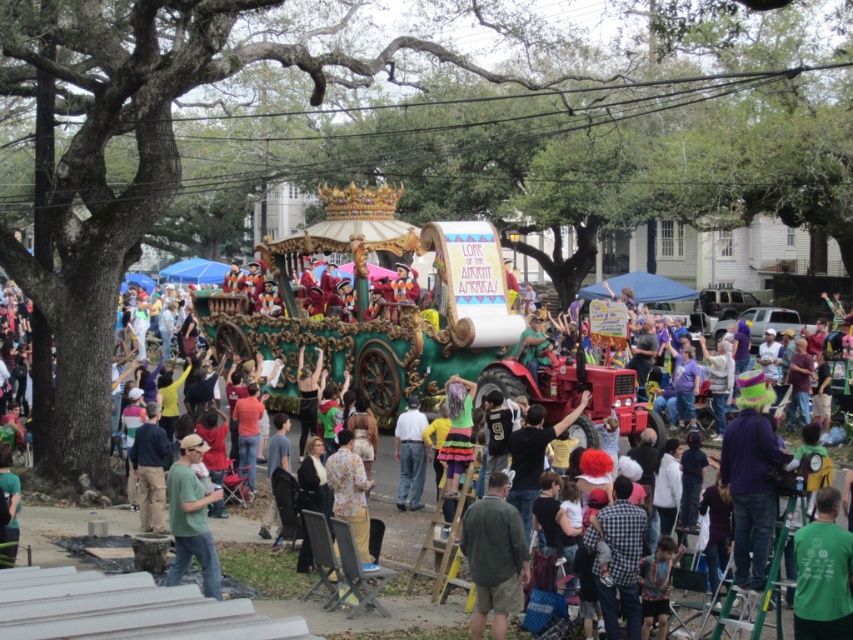
Question: Can you confirm if green fabric shirt at lower right is positioned below green cotton shirt at lower left?

Choices:
 (A) no
 (B) yes

Answer: (A)

Question: Among these points, which one is nearest to the camera?

Choices:
 (A) (822, 541)
 (B) (459, 432)

Answer: (A)

Question: Which point appears farthest from the camera in this image?

Choices:
 (A) (525, 538)
 (B) (834, 508)

Answer: (A)

Question: Which object is the closest to the white cotton shirt at center?

Choices:
 (A) green fabric shirt at lower right
 (B) green cotton shirt at center

Answer: (B)

Question: Is green cotton shirt at lower left positioned behind neon green jersey at center?

Choices:
 (A) yes
 (B) no

Answer: (B)

Question: Is green cotton shirt at center positioned in front of green fabric shirt at lower right?

Choices:
 (A) yes
 (B) no

Answer: (B)